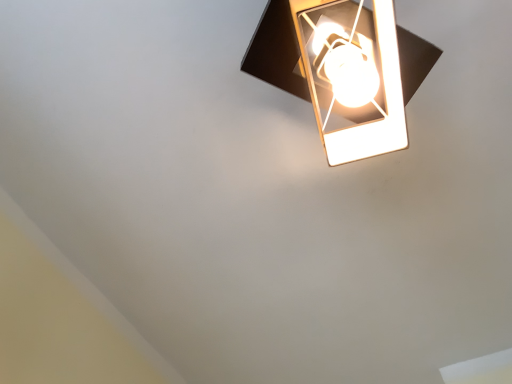
Question: Should I look upward or downward to see matte black lamp at upper right?

Choices:
 (A) up
 (B) down

Answer: (A)